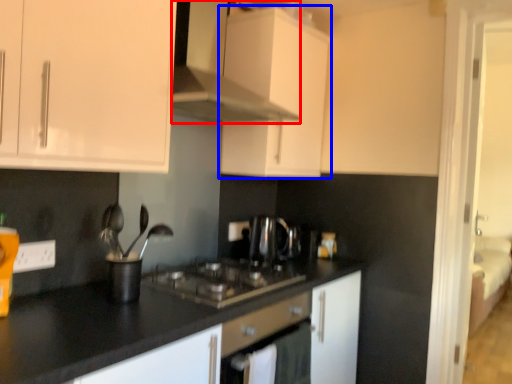
Question: Which object appears farthest to the camera in this image, cabinetry (highlighted by a red box) or cabinetry (highlighted by a blue box)?

Choices:
 (A) cabinetry
 (B) cabinetry

Answer: (B)